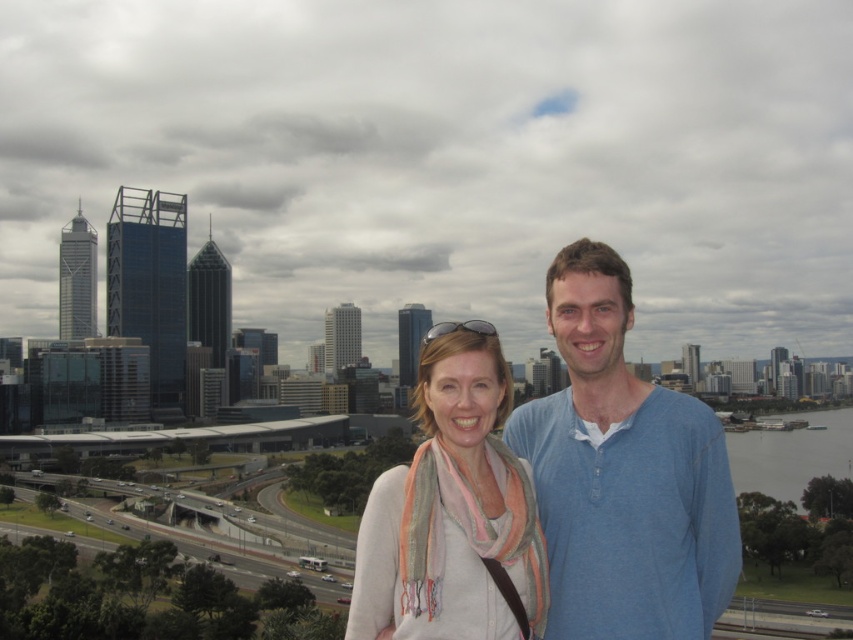
Question: Which object appears farthest from the camera in this image?

Choices:
 (A) blue cotton shirt at center
 (B) white soft scarf at center

Answer: (A)

Question: Which object appears closest to the camera in this image?

Choices:
 (A) white soft scarf at center
 (B) blue cotton shirt at center

Answer: (A)

Question: Does blue cotton shirt at center appear on the left side of white soft scarf at center?

Choices:
 (A) no
 (B) yes

Answer: (A)

Question: From the image, what is the correct spatial relationship of blue cotton shirt at center in relation to white soft scarf at center?

Choices:
 (A) below
 (B) above

Answer: (B)

Question: In this image, where is blue cotton shirt at center located relative to white soft scarf at center?

Choices:
 (A) left
 (B) right

Answer: (B)